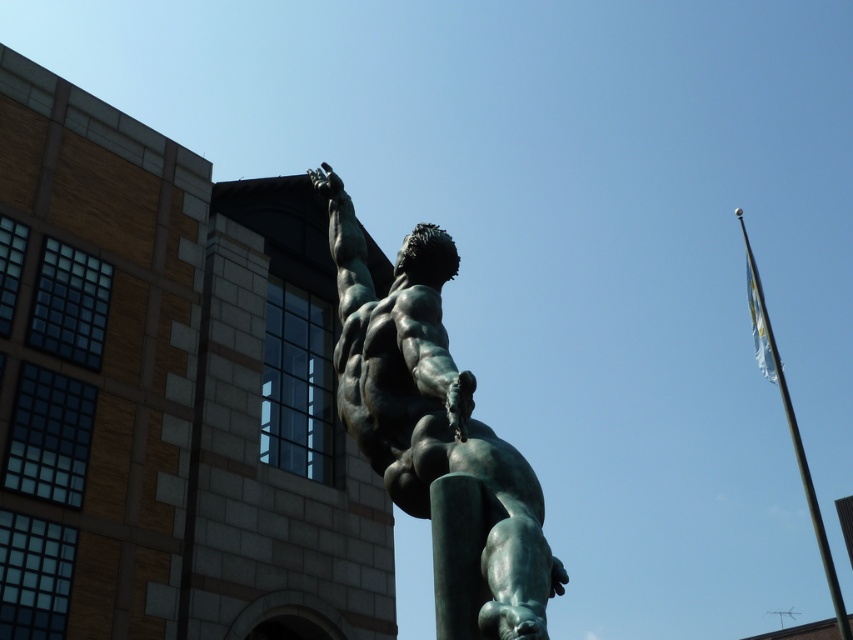
You are standing in front of a modern building with a statue. The statue is at the point with coordinates (436, 435). Can you tell me what the statue is made of?

The statue at point (436, 435) is made of bronze with a greenish patina.

You are standing in front of the bronze statue and want to determine the spatial relationship between two points marked on the image. Which point is closer to you, point [526,620] or point [759,298]?

Point [526,620] is in front of point [759,298], so it is closer to you.

You are standing in front of the green patina statue at center and want to walk towards the metallic flagpole at right. Which direction should you move to get closer to the flagpole?

Since the green patina statue at center is closer to the viewer than the metallic flagpole at right, you should move forward towards the flagpole at right to get closer to it.